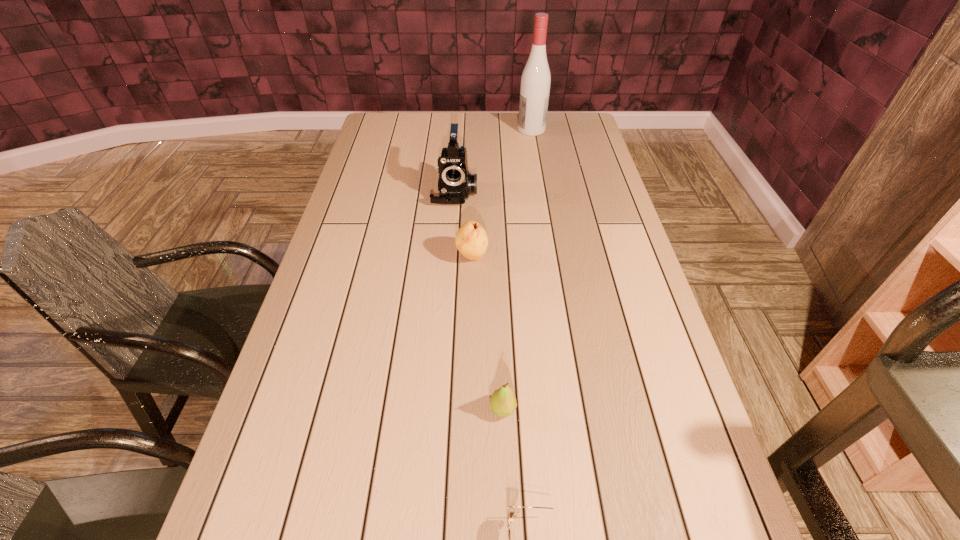
I want to click on vacant space located on the lens mount of the second tallest object, so click(449, 266).

The height and width of the screenshot is (540, 960). I want to click on blank space located on the back of the farther pear, so click(x=473, y=204).

The height and width of the screenshot is (540, 960). Identify the location of vacant region located 0.100m on the left of the fourth tallest object. (442, 409).

Locate an element on the screen. The width and height of the screenshot is (960, 540). object present at the far edge is located at coordinates (535, 82).

Image resolution: width=960 pixels, height=540 pixels. In the image, there is a desktop. What are the coordinates of `vacant space at the far edge` in the screenshot? It's located at (466, 121).

Find the location of a particular element. The width and height of the screenshot is (960, 540). free location at the left edge of the desktop is located at coordinates (365, 160).

The image size is (960, 540). Find the location of `free point at the right edge`. free point at the right edge is located at coordinates (582, 146).

You are a GUI agent. You are given a task and a screenshot of the screen. Output one action in this format:
    pyautogui.click(x=<x>, y=<y>)
    Task: Click on the free space between the third farthest object and the shorter pear
    
    Given the screenshot: What is the action you would take?
    pyautogui.click(x=488, y=333)

Where is `free spot between the camcorder and the alcohol`? This screenshot has width=960, height=540. free spot between the camcorder and the alcohol is located at coordinates (493, 161).

Locate an element on the screen. free spot between the second nearest object and the third nearest object is located at coordinates click(488, 333).